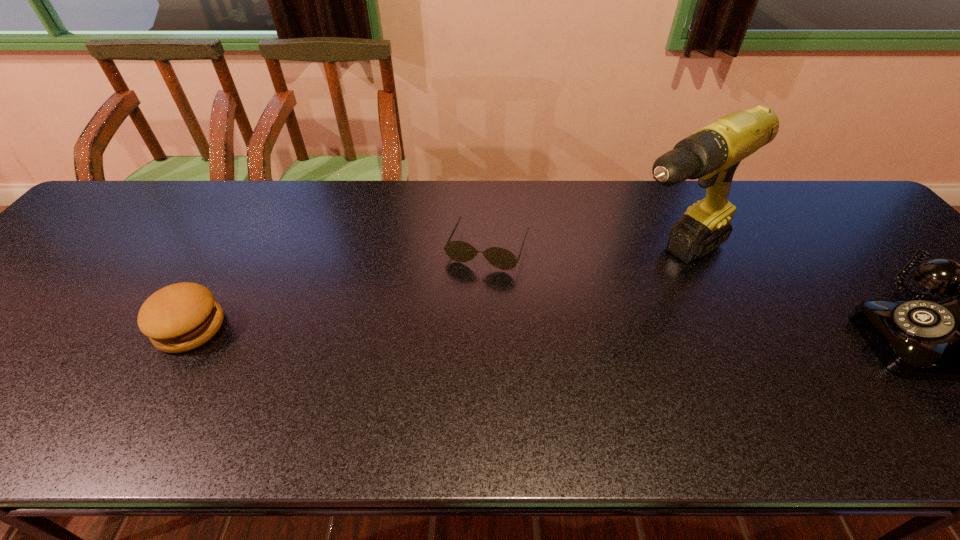
The width and height of the screenshot is (960, 540). In order to click on free space on the desktop that is between the third tallest object and the telephone and is positioned on the handle side of the drill in this screenshot , I will do `click(553, 333)`.

Locate an element on the screen. This screenshot has width=960, height=540. free spot on the desktop that is between the leftmost object and the second tallest object and is positioned on the front-facing side of the third object from right to left is located at coordinates (454, 332).